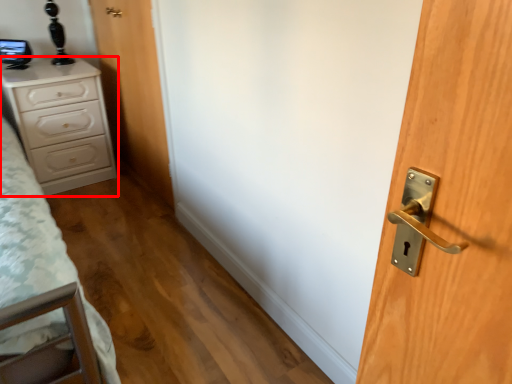
Question: From the image's perspective, what is the correct spatial relationship of chest of drawers (annotated by the red box) in relation to door?

Choices:
 (A) above
 (B) below

Answer: (B)